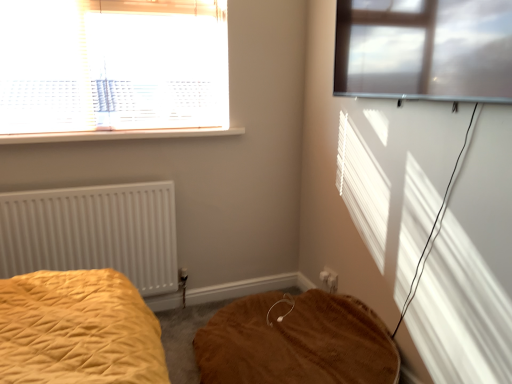
Question: Is white matte radiator at left outside transparent glass window at upper right, the 1th window from the front?

Choices:
 (A) no
 (B) yes

Answer: (B)

Question: Is white matte radiator at left oriented away from transparent glass window at upper right, acting as the first window starting from the right?

Choices:
 (A) no
 (B) yes

Answer: (A)

Question: Is white matte radiator at left thinner than transparent glass window at upper right, the 1th window from the front?

Choices:
 (A) no
 (B) yes

Answer: (B)

Question: Considering the relative positions of white matte radiator at left and transparent glass window at upper right, acting as the first window starting from the right, in the image provided, is white matte radiator at left behind transparent glass window at upper right, acting as the first window starting from the right,?

Choices:
 (A) yes
 (B) no

Answer: (A)

Question: Could you tell me if white matte radiator at left is turned towards transparent glass window at upper right, acting as the first window starting from the right?

Choices:
 (A) yes
 (B) no

Answer: (B)

Question: From a real-world perspective, is white matte radiator at left positioned over transparent glass window at upper right, acting as the first window starting from the right, based on gravity?

Choices:
 (A) yes
 (B) no

Answer: (B)

Question: Can you confirm if white plastic window at upper left, placed as the first window when sorted from back to front, is shorter than white plastic window sill at upper left?

Choices:
 (A) no
 (B) yes

Answer: (A)

Question: From a real-world perspective, is white plastic window at upper left, placed as the first window when sorted from back to front, positioned under white plastic window sill at upper left based on gravity?

Choices:
 (A) yes
 (B) no

Answer: (B)

Question: Does white plastic window at upper left, the second window viewed from the front, have a lesser width compared to white plastic window sill at upper left?

Choices:
 (A) yes
 (B) no

Answer: (A)

Question: Can you confirm if white plastic window at upper left, the second window viewed from the front, is wider than white plastic window sill at upper left?

Choices:
 (A) no
 (B) yes

Answer: (A)

Question: Would you say white plastic window at upper left, placed as the first window when sorted from back to front, contains white plastic window sill at upper left?

Choices:
 (A) no
 (B) yes

Answer: (A)

Question: From the image's perspective, does white plastic window at upper left, the second window viewed from the front, appear lower than white plastic window sill at upper left?

Choices:
 (A) no
 (B) yes

Answer: (A)

Question: From a real-world perspective, is white plastic window sill at upper left under white plastic window at upper left, positioned as the 2th window in right-to-left order?

Choices:
 (A) yes
 (B) no

Answer: (A)